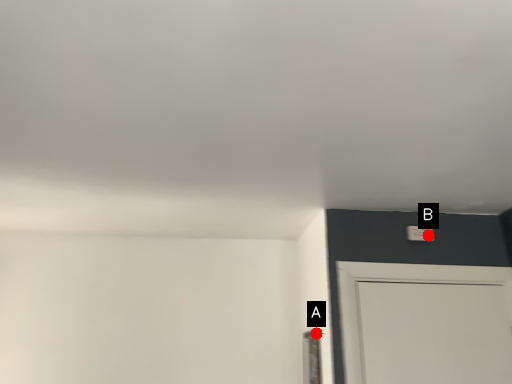
Question: Two points are circled on the image, labeled by A and B beside each circle. Which of the following is the closest to the observer?

Choices:
 (A) A is closer
 (B) B is closer

Answer: (A)